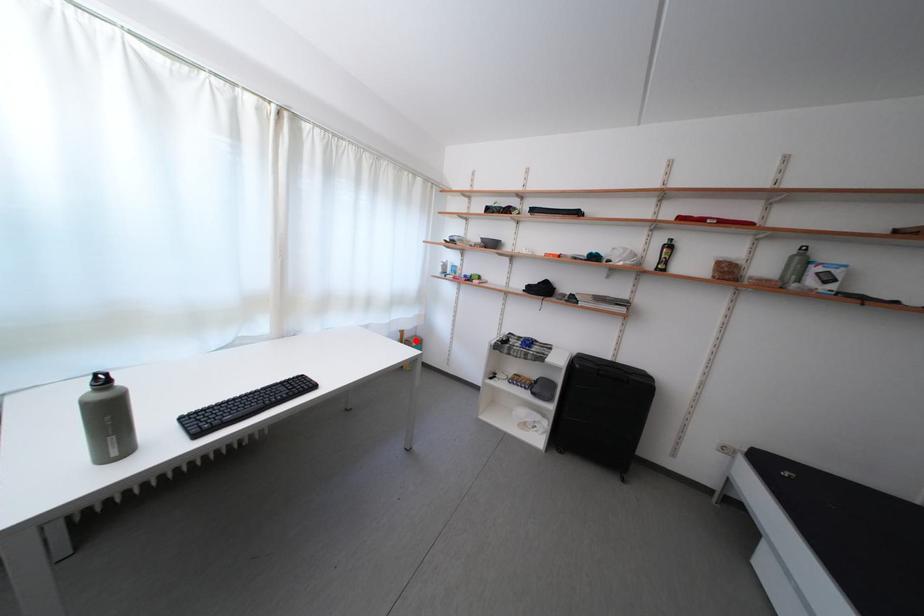
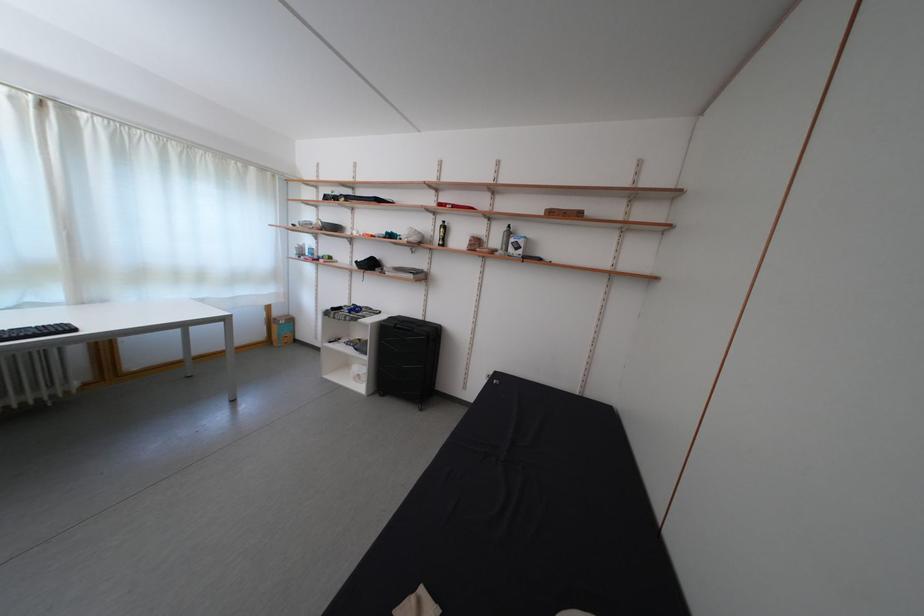
Question: I am providing you with two images of the same scene from different viewpoints. Image1 has a red point marked. In image2, the corresponding 3D location appears at what relative position? Reply with the corresponding letter.

Choices:
 (A) Closer
 (B) Farther

Answer: (B)